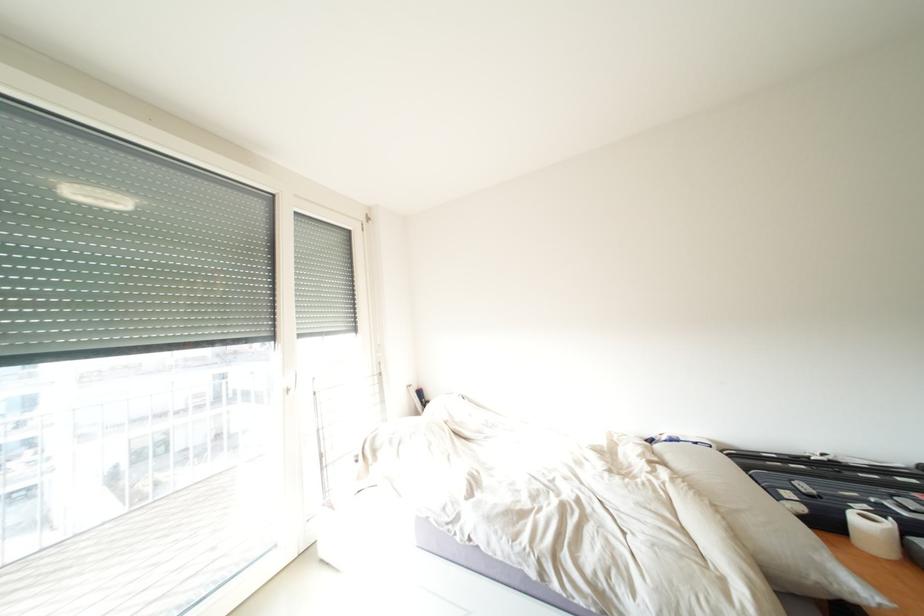
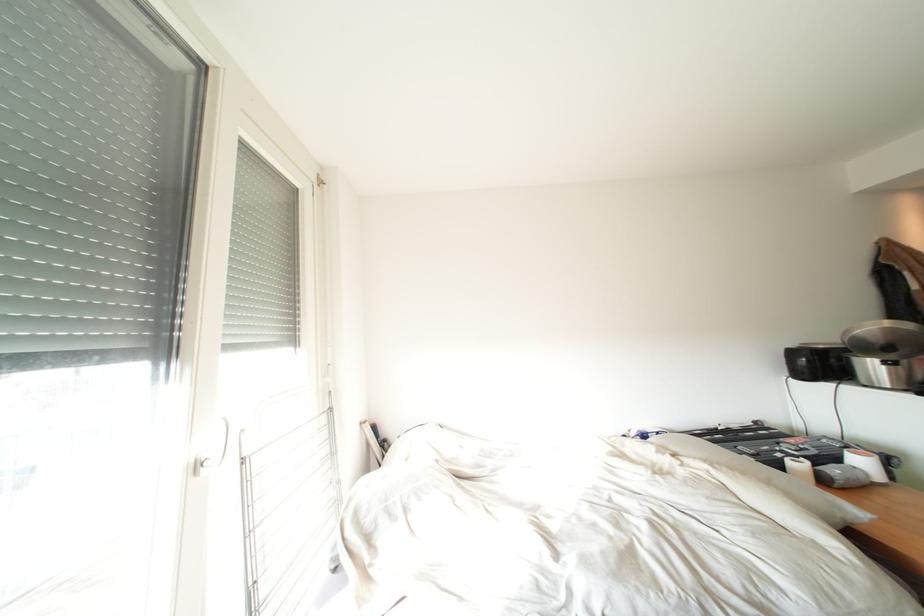
Where in the second image is the point corresponding to pixel 296 392 from the first image?

(205, 469)